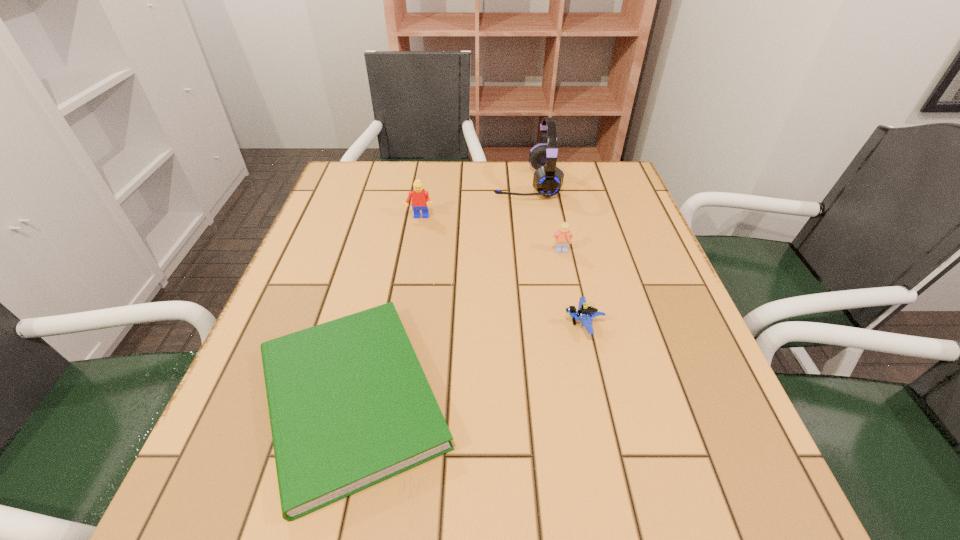
The image size is (960, 540). In order to click on Lego that is the closest to the farthest Lego in this screenshot , I will do [x=562, y=238].

The image size is (960, 540). I want to click on vacant area that satisfies the following two spatial constraints: 1. on the front-facing side of the nearest Lego; 2. on the front side of the shortest object, so click(x=600, y=399).

At what (x,y) coordinates should I click in order to perform the action: click on free region that satisfies the following two spatial constraints: 1. on the front-facing side of the shortest Lego; 2. on the front side of the paperback book. Please return your answer as a coordinate pair (x, y). Looking at the image, I should click on (600, 399).

Locate an element on the screen. This screenshot has height=540, width=960. free point that satisfies the following two spatial constraints: 1. on the ear cushions of the tallest object; 2. on the front-facing side of the tallest Lego is located at coordinates (531, 218).